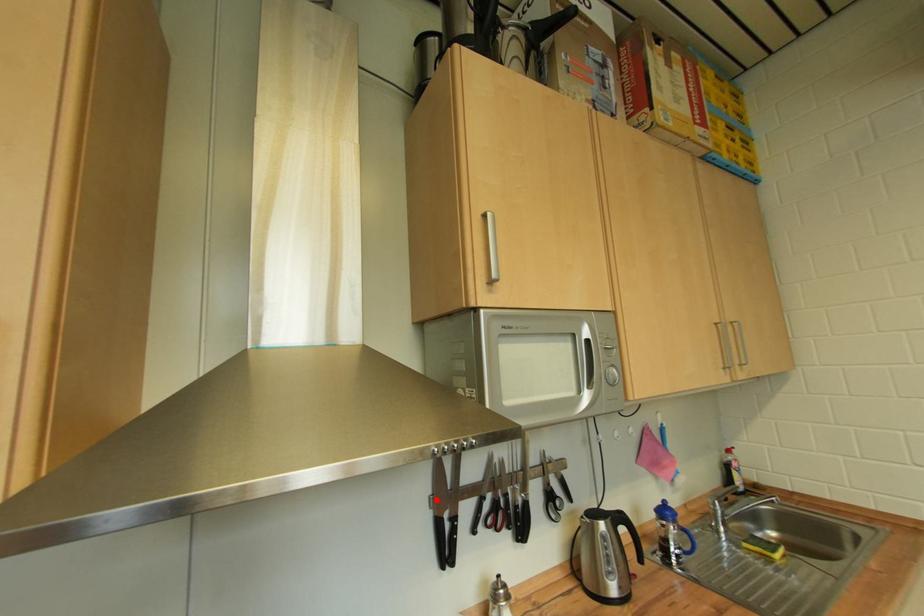
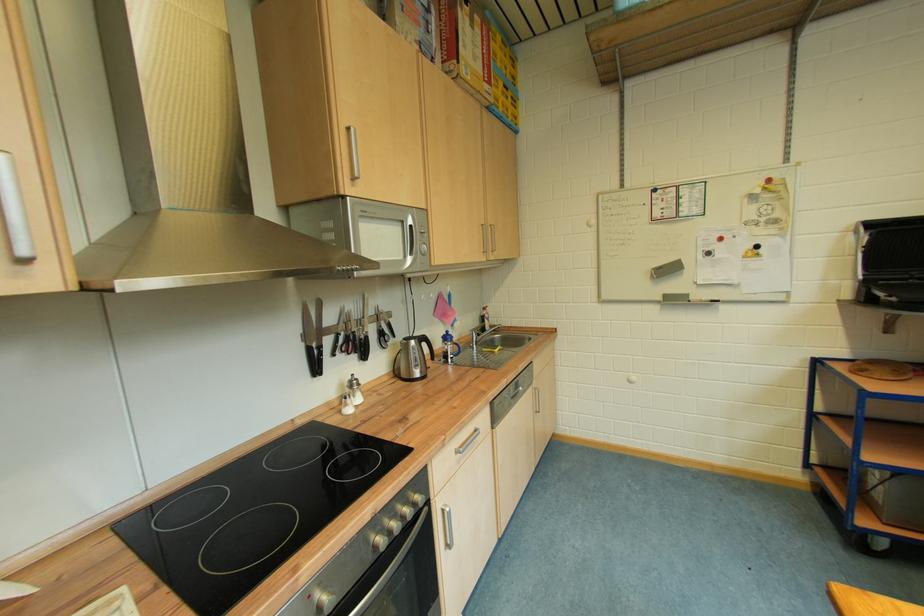
Find the pixel in the second image that matches the highlighted location in the first image.

(310, 337)